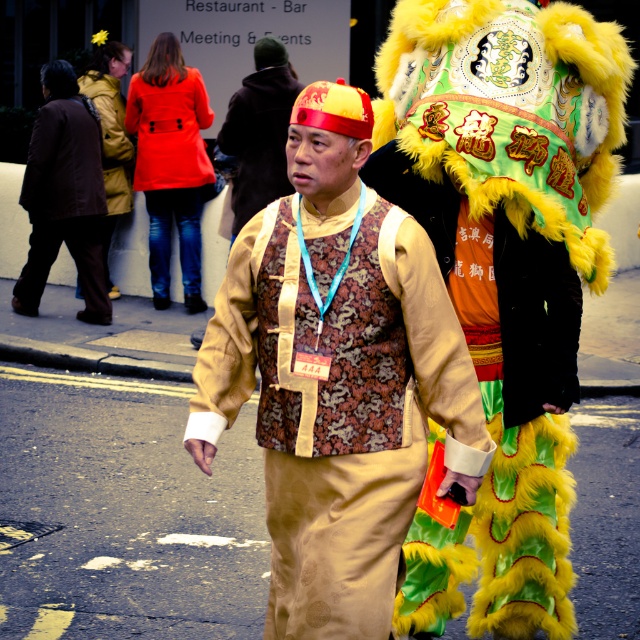
Does matte brown vest at center have a lesser height compared to yellow furry headdress at upper right?

Incorrect, matte brown vest at center's height does not fall short of yellow furry headdress at upper right's.

The height and width of the screenshot is (640, 640). What do you see at coordinates (337, 376) in the screenshot?
I see `matte brown vest at center` at bounding box center [337, 376].

I want to click on matte brown vest at center, so click(x=337, y=376).

Who is taller, yellow furry headdress at upper right or matte red coat at upper left?

matte red coat at upper left is taller.

Who is more distant from viewer, (541, 230) or (152, 243)?

The point (152, 243) is behind.

Identify the location of yellow furry headdress at upper right. This screenshot has height=640, width=640. [x=509, y=112].

Is point (451, 397) in front of point (168, 209)?

That is True.

Does matte brown vest at center come behind matte red coat at upper left?

No, it is not.

Who is more forward, (388, 316) or (134, 122)?

Positioned in front is point (388, 316).

The width and height of the screenshot is (640, 640). Find the location of `matte brown vest at center`. matte brown vest at center is located at coordinates (337, 376).